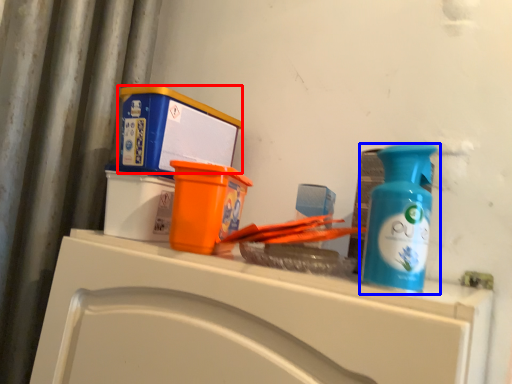
Question: Which point is closer to the camera, box (highlighted by a red box) or bottle (highlighted by a blue box)?

Choices:
 (A) box
 (B) bottle

Answer: (B)